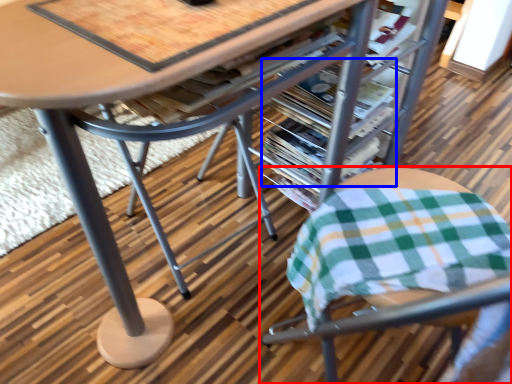
Question: Which object is further to the camera taking this photo, chair (highlighted by a red box) or magazine (highlighted by a blue box)?

Choices:
 (A) chair
 (B) magazine

Answer: (B)